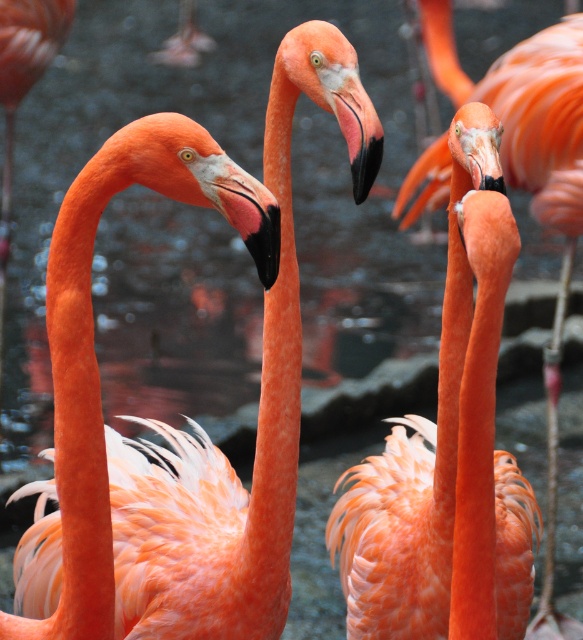
Who is lower down, matte orange flamingo at center or matte black beak at center?

matte orange flamingo at center

Is point (261, 481) farther from viewer compared to point (238, 205)?

Yes, point (261, 481) is farther from viewer.

Where is `matte orange flamingo at center`? The height and width of the screenshot is (640, 583). matte orange flamingo at center is located at coordinates (220, 451).

Does matte black beak at center have a larger size compared to black matte beak at center?

No.

Who is more forward, (264, 228) or (374, 152)?

Positioned in front is point (264, 228).

You are a GUI agent. You are given a task and a screenshot of the screen. Output one action in this format:
    pyautogui.click(x=<x>, y=<y>)
    Task: Click on the matte black beak at center
    The width and height of the screenshot is (583, 640).
    Given the screenshot: What is the action you would take?
    pyautogui.click(x=247, y=211)

Does orange feathered flamingo at center have a smaller size compared to black matte beak at center?

Incorrect, orange feathered flamingo at center is not smaller in size than black matte beak at center.

Does orange feathered flamingo at center have a greater width compared to black matte beak at center?

Indeed, orange feathered flamingo at center has a greater width compared to black matte beak at center.

What do you see at coordinates (416, 451) in the screenshot?
I see `orange feathered flamingo at center` at bounding box center [416, 451].

Find the location of a particular element. The width and height of the screenshot is (583, 640). orange feathered flamingo at center is located at coordinates (416, 451).